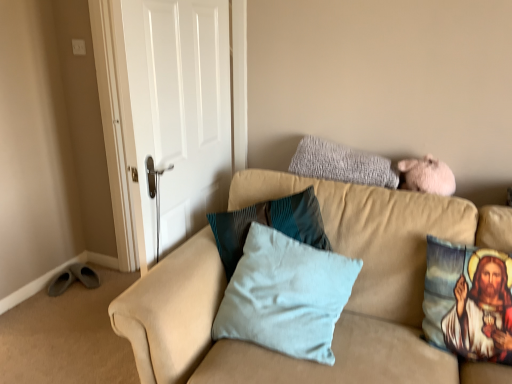
Question: Does beige fabric couch at upper right appear on the right side of light blue fabric pillow at center, positioned as the first pillow in left-to-right order?

Choices:
 (A) yes
 (B) no

Answer: (A)

Question: Does beige fabric couch at upper right have a greater height compared to light blue fabric pillow at center, the third pillow positioned from the right?

Choices:
 (A) yes
 (B) no

Answer: (A)

Question: From a real-world perspective, does beige fabric couch at upper right stand above light blue fabric pillow at center, the third pillow positioned from the right?

Choices:
 (A) yes
 (B) no

Answer: (B)

Question: Is light blue fabric pillow at center, the third pillow positioned from the right, completely or partially inside beige fabric couch at upper right?

Choices:
 (A) no
 (B) yes

Answer: (B)

Question: Can you confirm if beige fabric couch at upper right is thinner than light blue fabric pillow at center, the third pillow positioned from the right?

Choices:
 (A) no
 (B) yes

Answer: (A)

Question: Can you confirm if beige fabric couch at upper right is wider than light blue fabric pillow at center, the third pillow positioned from the right?

Choices:
 (A) no
 (B) yes

Answer: (B)

Question: From a real-world perspective, is white matte door at upper left positioned over printed fabric pillow with religious image at right, positioned as the 1th pillow in right-to-left order, based on gravity?

Choices:
 (A) yes
 (B) no

Answer: (A)

Question: From a real-world perspective, does white matte door at upper left sit lower than printed fabric pillow with religious image at right, the third pillow when ordered from left to right?

Choices:
 (A) yes
 (B) no

Answer: (B)

Question: Is white matte door at upper left turned away from printed fabric pillow with religious image at right, positioned as the 1th pillow in right-to-left order?

Choices:
 (A) yes
 (B) no

Answer: (A)

Question: Considering the relative sizes of white matte door at upper left and printed fabric pillow with religious image at right, positioned as the 1th pillow in right-to-left order, in the image provided, is white matte door at upper left wider than printed fabric pillow with religious image at right, positioned as the 1th pillow in right-to-left order,?

Choices:
 (A) yes
 (B) no

Answer: (B)

Question: Does white matte door at upper left have a smaller size compared to printed fabric pillow with religious image at right, the third pillow when ordered from left to right?

Choices:
 (A) yes
 (B) no

Answer: (B)

Question: Is the position of white matte door at upper left more distant than that of printed fabric pillow with religious image at right, the third pillow when ordered from left to right?

Choices:
 (A) yes
 (B) no

Answer: (A)

Question: Can you confirm if printed fabric pillow with religious image at right, positioned as the 1th pillow in right-to-left order, is wider than white matte door at upper left?

Choices:
 (A) no
 (B) yes

Answer: (B)